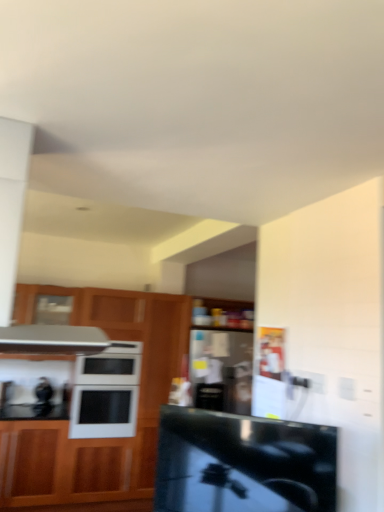
What do you see at coordinates (98, 439) in the screenshot? I see `wooden cabinet at left` at bounding box center [98, 439].

What is the approximate height of wooden cabinet at left?

2.08 meters.

This screenshot has width=384, height=512. What do you see at coordinates (106, 392) in the screenshot?
I see `white glossy microwave oven at center` at bounding box center [106, 392].

This screenshot has width=384, height=512. What do you see at coordinates (243, 463) in the screenshot? I see `black glossy countertop at center` at bounding box center [243, 463].

The width and height of the screenshot is (384, 512). In order to click on wooden cabinet at left in this screenshot , I will do [x=98, y=439].

Considering the relative sizes of black glossy countertop at center and wooden cabinet at left in the image provided, is black glossy countertop at center bigger than wooden cabinet at left?

No.

Which object is positioned more to the right, black glossy countertop at center or wooden cabinet at left?

black glossy countertop at center is more to the right.

How many degrees apart are the facing directions of black glossy countertop at center and wooden cabinet at left?

The angle between the facing direction of black glossy countertop at center and the facing direction of wooden cabinet at left is 42.9 degrees.

Considering the sizes of objects black glossy countertop at center and wooden cabinet at left in the image provided, who is wider, black glossy countertop at center or wooden cabinet at left?

With larger width is wooden cabinet at left.

From the image's perspective, is black glossy countertop at center above white glossy microwave oven at center?

Yes, from the image's perspective, black glossy countertop at center is over white glossy microwave oven at center.

Which object is positioned more to the left, black glossy countertop at center or white glossy microwave oven at center?

white glossy microwave oven at center is more to the left.

Can you confirm if black glossy countertop at center is smaller than white glossy microwave oven at center?

Yes, black glossy countertop at center is smaller than white glossy microwave oven at center.

This screenshot has width=384, height=512. In order to click on counter top in front of the white glossy microwave oven at center in this screenshot , I will do `click(243, 463)`.

Consider the image. From a real-world perspective, is white glossy microwave oven at center located beneath wooden cabinet at left?

A: No, from a real-world perspective, white glossy microwave oven at center is not below wooden cabinet at left.

Would you say white glossy microwave oven at center is inside or outside wooden cabinet at left?

white glossy microwave oven at center can be found inside wooden cabinet at left.

Is white glossy microwave oven at center further to camera compared to wooden cabinet at left?

That is True.

Considering the relative positions of white glossy microwave oven at center and wooden cabinet at left in the image provided, is white glossy microwave oven at center to the right of wooden cabinet at left from the viewer's perspective?

In fact, white glossy microwave oven at center is to the left of wooden cabinet at left.

Which object is thinner, wooden cabinet at left or black glossy countertop at center?

Thinner between the two is black glossy countertop at center.

From the image's perspective, which object appears higher, wooden cabinet at left or black glossy countertop at center?

black glossy countertop at center, from the image's perspective.

How distant is wooden cabinet at left from black glossy countertop at center?

wooden cabinet at left is 2.53 meters away from black glossy countertop at center.

Is white glossy microwave oven at center placed right next to black glossy countertop at center?

No, white glossy microwave oven at center is not in contact with black glossy countertop at center.

Would you say white glossy microwave oven at center contains black glossy countertop at center?

No, black glossy countertop at center is located outside of white glossy microwave oven at center.

In terms of height, does white glossy microwave oven at center look taller or shorter compared to black glossy countertop at center?

Clearly, white glossy microwave oven at center is taller compared to black glossy countertop at center.

Is white glossy microwave oven at center further to camera compared to black glossy countertop at center?

Yes, white glossy microwave oven at center is further from the camera.

Does wooden cabinet at left have a greater height compared to white glossy microwave oven at center?

Yes, wooden cabinet at left is taller than white glossy microwave oven at center.

Measure the distance from wooden cabinet at left to white glossy microwave oven at center.

wooden cabinet at left is 27.10 centimeters from white glossy microwave oven at center.

Is wooden cabinet at left aimed at white glossy microwave oven at center?

Yes, wooden cabinet at left is aimed at white glossy microwave oven at center.

Is wooden cabinet at left at the left side of white glossy microwave oven at center?

No, wooden cabinet at left is not to the left of white glossy microwave oven at center.

Find the location of a particular element. This screenshot has width=384, height=512. cabinetry that is on the left side of black glossy countertop at center is located at coordinates (98, 439).

What are the coordinates of `counter top located in front of the white glossy microwave oven at center` in the screenshot? It's located at pyautogui.click(x=243, y=463).

Which object lies nearer to the anchor point white glossy microwave oven at center, wooden cabinet at left or black glossy countertop at center?

Based on the image, wooden cabinet at left appears to be nearer to white glossy microwave oven at center.

Which object lies nearer to the anchor point black glossy countertop at center, wooden cabinet at left or white glossy microwave oven at center?

white glossy microwave oven at center is positioned closer to the anchor black glossy countertop at center.

Consider the image. Based on their spatial positions, is black glossy countertop at center or wooden cabinet at left closer to white glossy microwave oven at center?

Among the two, wooden cabinet at left is located nearer to white glossy microwave oven at center.

Estimate the real-world distances between objects in this image. Which object is further from black glossy countertop at center, white glossy microwave oven at center or wooden cabinet at left?

wooden cabinet at left lies further to black glossy countertop at center than the other object.

Considering their positions, is black glossy countertop at center positioned further to wooden cabinet at left than white glossy microwave oven at center?

Based on the image, black glossy countertop at center appears to be further to wooden cabinet at left.

Consider the image. Estimate the real-world distances between objects in this image. Which object is closer to wooden cabinet at left, white glossy microwave oven at center or black glossy countertop at center?

Among the two, white glossy microwave oven at center is located nearer to wooden cabinet at left.

The width and height of the screenshot is (384, 512). Find the location of `cabinetry between black glossy countertop at center and white glossy microwave oven at center from front to back`. cabinetry between black glossy countertop at center and white glossy microwave oven at center from front to back is located at coordinates (98, 439).